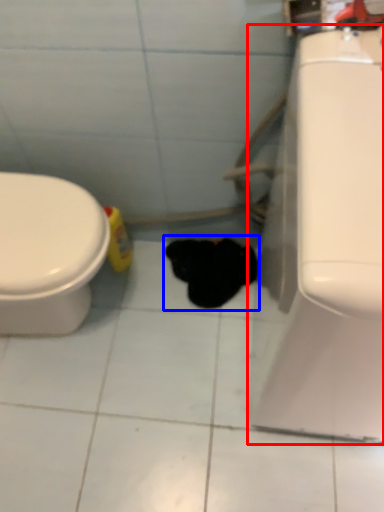
Question: Among these objects, which one is farthest to the camera, porcelain (highlighted by a red box) or animal (highlighted by a blue box)?

Choices:
 (A) porcelain
 (B) animal

Answer: (B)